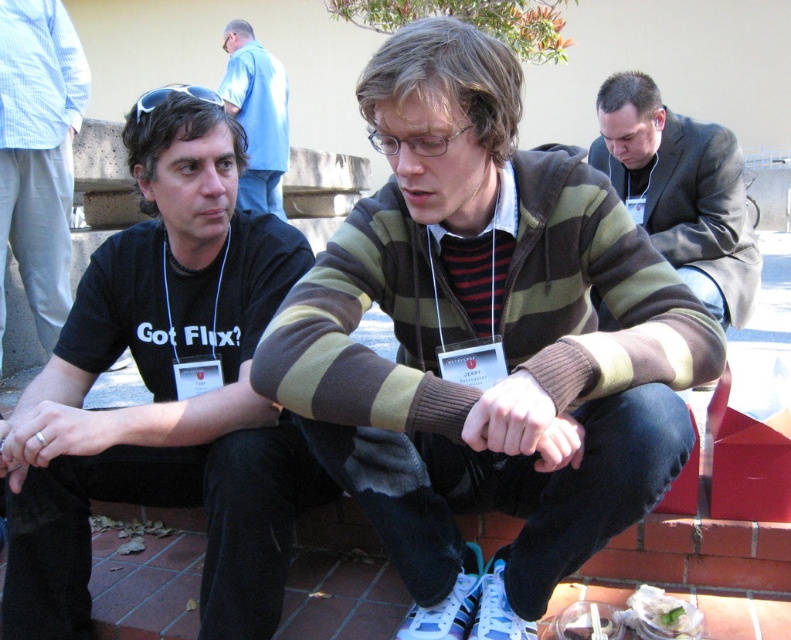
Question: Which point is closer to the camera?

Choices:
 (A) blue suede shoe at lower center
 (B) white paper plate at lower right
 (C) light blue shirt at upper center

Answer: (A)

Question: Among these objects, which one is nearest to the camera?

Choices:
 (A) light blue shirt at upper center
 (B) black matte t-shirt at left

Answer: (B)

Question: Is black cotton t-shirt at left smaller than blue suede shoe at lower center?

Choices:
 (A) yes
 (B) no

Answer: (B)

Question: Is white paper plate at lower right to the right of translucent plastic bag at lower center from the viewer's perspective?

Choices:
 (A) yes
 (B) no

Answer: (A)

Question: Which point is closer to the camera?

Choices:
 (A) striped sweater at center
 (B) dark gray suit at center

Answer: (A)

Question: Can you confirm if dark gray suit at center is positioned to the right of white paper plate at lower right?

Choices:
 (A) no
 (B) yes

Answer: (B)